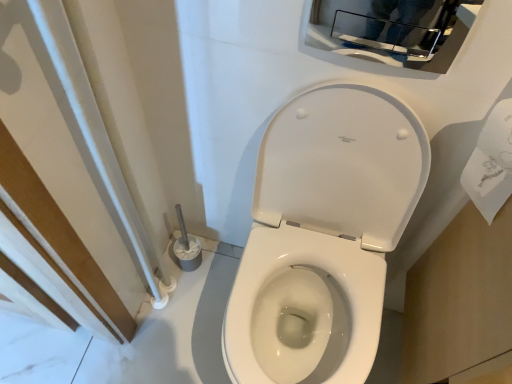
Question: From a real-world perspective, is white glossy toilet at center located higher than glossy chrome medicine cabinet at upper center?

Choices:
 (A) yes
 (B) no

Answer: (B)

Question: Is white glossy toilet at center not inside glossy chrome medicine cabinet at upper center?

Choices:
 (A) yes
 (B) no

Answer: (A)

Question: Considering the relative positions of white glossy toilet at center and glossy chrome medicine cabinet at upper center in the image provided, is white glossy toilet at center behind glossy chrome medicine cabinet at upper center?

Choices:
 (A) yes
 (B) no

Answer: (B)

Question: Considering the relative positions of white glossy toilet at center and glossy chrome medicine cabinet at upper center in the image provided, is white glossy toilet at center to the right of glossy chrome medicine cabinet at upper center from the viewer's perspective?

Choices:
 (A) no
 (B) yes

Answer: (A)

Question: Does white glossy toilet at center have a larger size compared to glossy chrome medicine cabinet at upper center?

Choices:
 (A) no
 (B) yes

Answer: (B)

Question: Considering the relative positions of white paper towel at right and white glossy toilet at center in the image provided, is white paper towel at right to the left or to the right of white glossy toilet at center?

Choices:
 (A) right
 (B) left

Answer: (A)

Question: From a real-world perspective, is white paper towel at right physically located above or below white glossy toilet at center?

Choices:
 (A) below
 (B) above

Answer: (B)

Question: From the image's perspective, relative to white glossy toilet at center, is white paper towel at right above or below?

Choices:
 (A) below
 (B) above

Answer: (B)

Question: Based on their sizes in the image, would you say white paper towel at right is bigger or smaller than white glossy toilet at center?

Choices:
 (A) small
 (B) big

Answer: (A)

Question: From a real-world perspective, is white glossy toilet at center physically located above or below glossy chrome medicine cabinet at upper center?

Choices:
 (A) below
 (B) above

Answer: (A)

Question: From the image's perspective, is white glossy toilet at center positioned above or below glossy chrome medicine cabinet at upper center?

Choices:
 (A) above
 (B) below

Answer: (B)

Question: In terms of width, does white glossy toilet at center look wider or thinner when compared to glossy chrome medicine cabinet at upper center?

Choices:
 (A) thin
 (B) wide

Answer: (B)

Question: Considering the positions of white glossy toilet at center and glossy chrome medicine cabinet at upper center in the image, is white glossy toilet at center bigger or smaller than glossy chrome medicine cabinet at upper center?

Choices:
 (A) big
 (B) small

Answer: (A)

Question: Do you think white paper towel at right is within glossy chrome medicine cabinet at upper center, or outside of it?

Choices:
 (A) inside
 (B) outside

Answer: (B)

Question: Considering the positions of white paper towel at right and glossy chrome medicine cabinet at upper center in the image, is white paper towel at right bigger or smaller than glossy chrome medicine cabinet at upper center?

Choices:
 (A) big
 (B) small

Answer: (A)